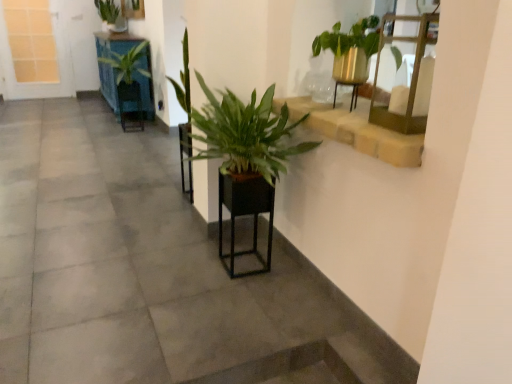
At what (x,y) coordinates should I click in order to perform the action: click on free space in front of black matte planter at center, which ranks as the first armchair in right-to-left order. Please return your answer as a coordinate pair (x, y). Looking at the image, I should click on (243, 289).